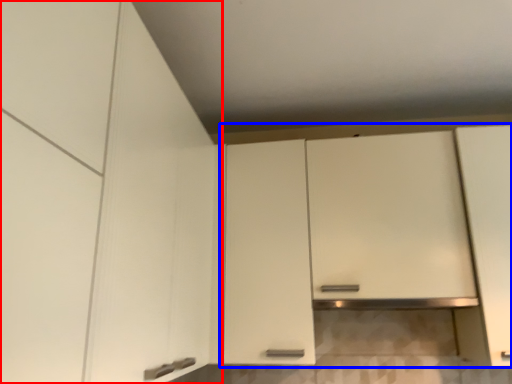
Question: Which object is further to the camera taking this photo, cabinetry (highlighted by a red box) or cabinetry (highlighted by a blue box)?

Choices:
 (A) cabinetry
 (B) cabinetry

Answer: (B)